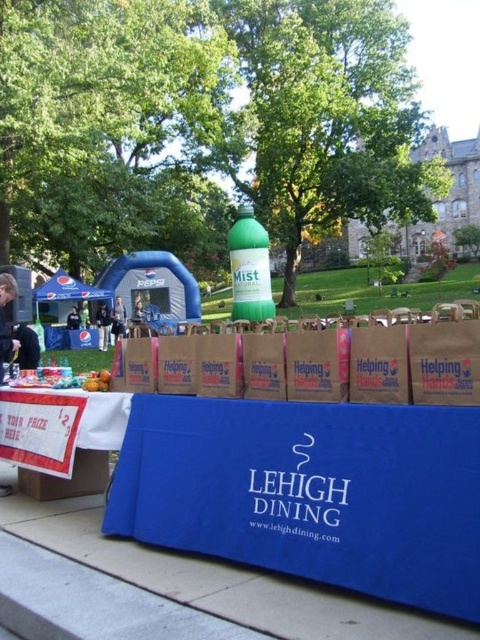
You are organizing an outdoor event and need to place a 10 feet long banner between the green matte bottle at center and the black shirt at left. Is there enough space between them to fit the banner?

The distance between the green matte bottle at center and the black shirt at left is 19.02 feet, which is greater than the 10 feet length of the banner. Therefore, there is enough space to fit the banner between them.

You are standing at the center of the outdoor event setup. There is a point marked at coordinates (184,584). Which object at this point is the main table covered with blue cloth from Lehigh Dining?

The blue fabric table at center is represented by point (184,584).

You are organizing an event at Lehigh University and need to place a new sign that must be shorter than the black shirt at left. Can the green matte bottle at center be used as the sign?

The green matte bottle at center is taller than the black shirt at left, so it cannot be used as the sign since it exceeds the required height.